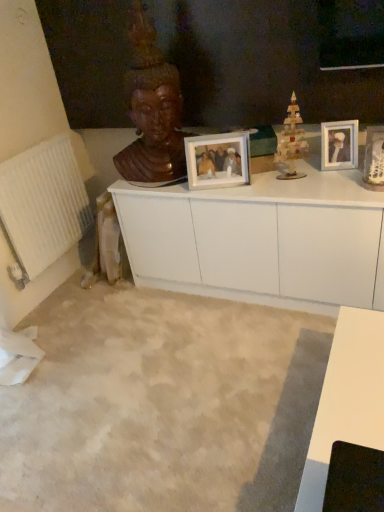
Question: In terms of size, does white glossy cabinet at center appear bigger or smaller than white glossy picture frame at upper right, the 1th picture frame from the right?

Choices:
 (A) small
 (B) big

Answer: (B)

Question: From a real-world perspective, relative to white glossy picture frame at upper right, the 1th picture frame from the right, is white glossy cabinet at center vertically above or below?

Choices:
 (A) above
 (B) below

Answer: (B)

Question: Estimate the real-world distances between objects in this image. Which object is farther from the wooden statue at upper center?

Choices:
 (A) matte white picture frame at center, the 2th picture frame in the right-to-left sequence
 (B) white glossy picture frame at upper right, the 1th picture frame from the right
 (C) wooden toy at center
 (D) white glossy cabinet at center
 (E) white textured radiator at left

Answer: (B)

Question: Which is farther from the white glossy picture frame at upper right, the 2th picture frame from the left?

Choices:
 (A) white textured radiator at left
 (B) matte white picture frame at center, which is the 1th picture frame from left to right
 (C) wooden statue at upper center
 (D) white glossy cabinet at center
 (E) wooden toy at center

Answer: (A)